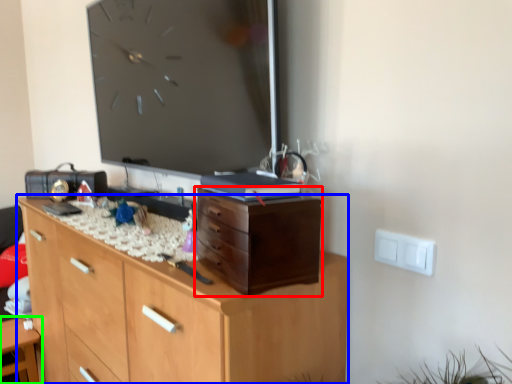
Question: Which object is the farthest from chest of drawers (highlighted by a red box)? Choose among these: chest of drawers (highlighted by a blue box) or table (highlighted by a green box).

Choices:
 (A) chest of drawers
 (B) table

Answer: (B)